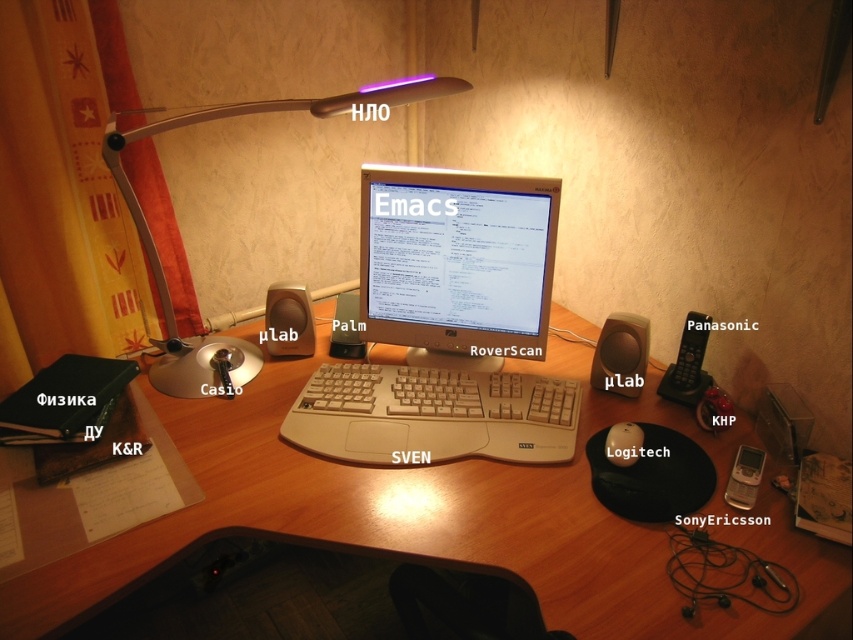
You are a developer who wants to place a new monitor on your desk. The desk has a coordinate system where the bottom left corner is at point 0,0 and the top right corner is at 1,1. The beige plastic monitor at center is already placed at point 0.511, 0.524. If you want to place a new monitor 0.1 units to the right and 0.05 units above the existing one, what would be the coordinates of the new monitor?

The new monitor would be placed at coordinates (489, 390).

You are a delivery person who needs to place a new camera on the desk without moving the beige plastic monitor at center. The camera requires at least 1 meter of space from the monitor. Can you place it on the desk?

The beige plastic monitor at center and camera are 1.01 meters apart from each other, so yes, the camera can be placed on the desk as the distance is sufficient.